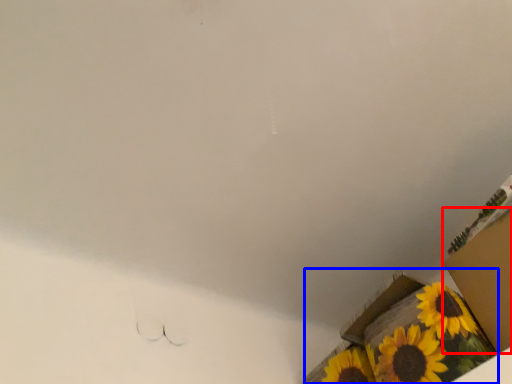
Question: Which object is further to the camera taking this photo, cardboard box (highlighted by a red box) or cardboard box (highlighted by a blue box)?

Choices:
 (A) cardboard box
 (B) cardboard box

Answer: (B)